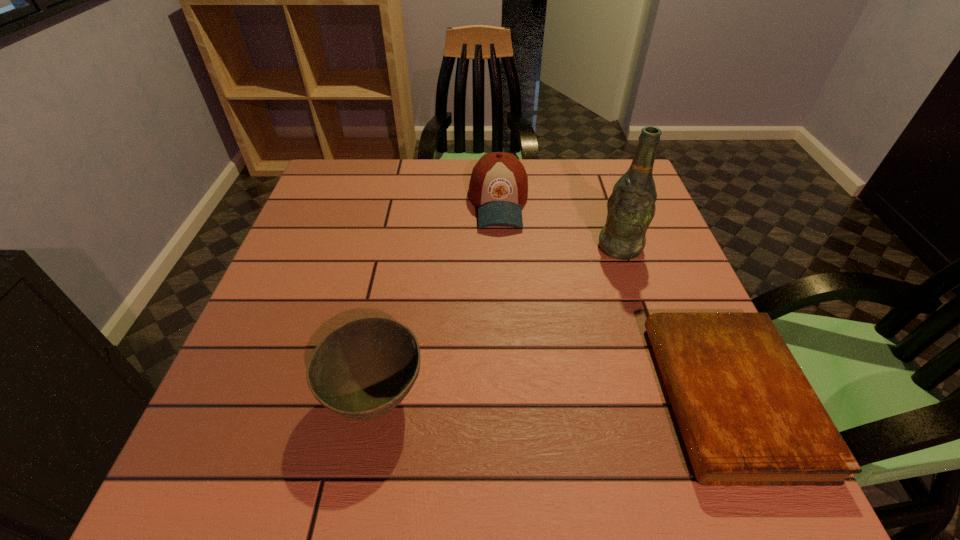
The image size is (960, 540). Find the location of `vacant region that satisfies the following two spatial constraints: 1. on the front side of the Bible; 2. on the spine side of the baseball cap`. vacant region that satisfies the following two spatial constraints: 1. on the front side of the Bible; 2. on the spine side of the baseball cap is located at coordinates (509, 397).

This screenshot has height=540, width=960. Find the location of `vacant region that satisfies the following two spatial constraints: 1. on the back side of the tallest object; 2. on the left side of the leftmost object`. vacant region that satisfies the following two spatial constraints: 1. on the back side of the tallest object; 2. on the left side of the leftmost object is located at coordinates (403, 247).

Where is `free space that satisfies the following two spatial constraints: 1. on the front side of the tallest object; 2. on the spine side of the Bible`? This screenshot has height=540, width=960. free space that satisfies the following two spatial constraints: 1. on the front side of the tallest object; 2. on the spine side of the Bible is located at coordinates (671, 397).

I want to click on vacant space that satisfies the following two spatial constraints: 1. on the back side of the Bible; 2. on the spine side of the leftmost object, so click(x=375, y=397).